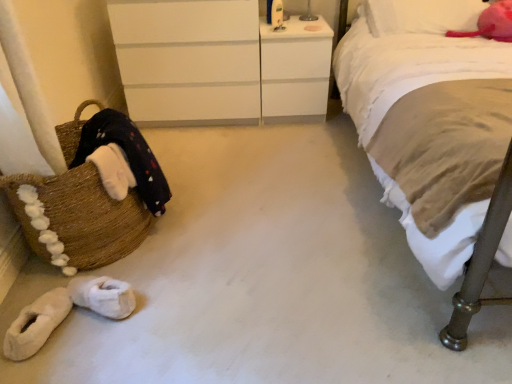
This screenshot has width=512, height=384. In order to click on unoccupied space behind white fluffy slippers at lower left, placed as the 2th footwear when sorted from left to right in this screenshot , I will do point(127,266).